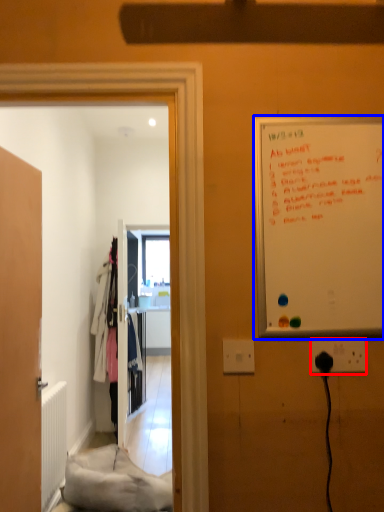
Question: Which of the following is the closest to the observer, electric outlet (highlighted by a red box) or whiteboard (highlighted by a blue box)?

Choices:
 (A) electric outlet
 (B) whiteboard

Answer: (B)